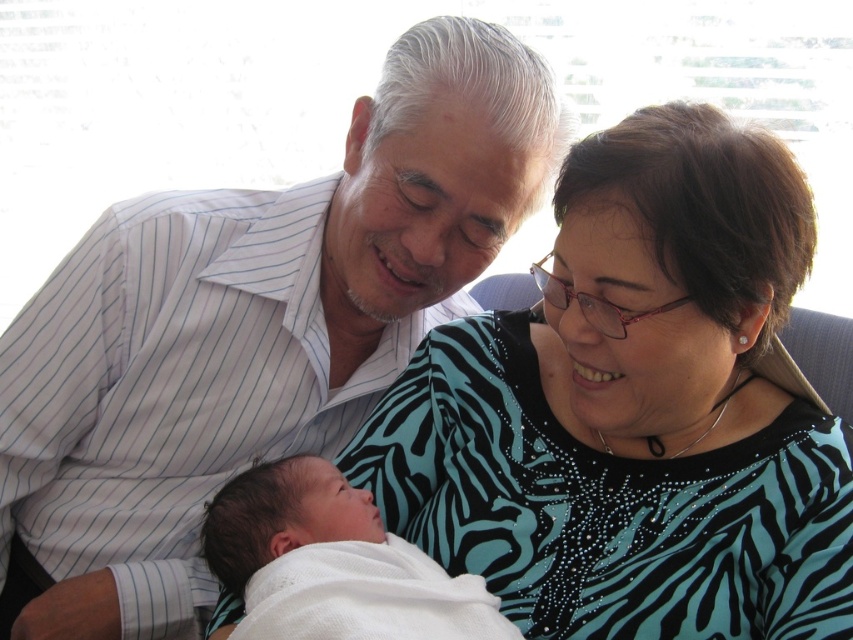
Question: Which point appears farthest from the camera in this image?

Choices:
 (A) (24, 515)
 (B) (538, 570)

Answer: (A)

Question: Does white striped shirt at upper left have a larger size compared to white soft cloth at center?

Choices:
 (A) no
 (B) yes

Answer: (B)

Question: Estimate the real-world distances between objects in this image. Which object is closer to the white soft cloth at center?

Choices:
 (A) zebra print blouse at center
 (B) white striped shirt at upper left

Answer: (A)

Question: Is white striped shirt at upper left positioned before white soft cloth at center?

Choices:
 (A) no
 (B) yes

Answer: (A)

Question: Considering the relative positions of white striped shirt at upper left and white soft cloth at center in the image provided, where is white striped shirt at upper left located with respect to white soft cloth at center?

Choices:
 (A) above
 (B) below

Answer: (A)

Question: Which object appears farthest from the camera in this image?

Choices:
 (A) white soft cloth at center
 (B) zebra print blouse at center

Answer: (B)